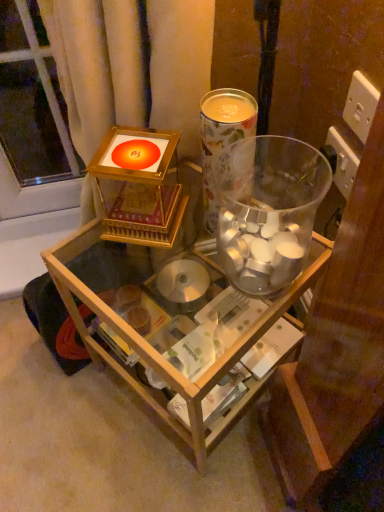
Locate an element on the screen. The width and height of the screenshot is (384, 512). vacant space to the left of floral paper cup at upper center, placed as the second beverage when sorted from bottom to top is located at coordinates (123, 264).